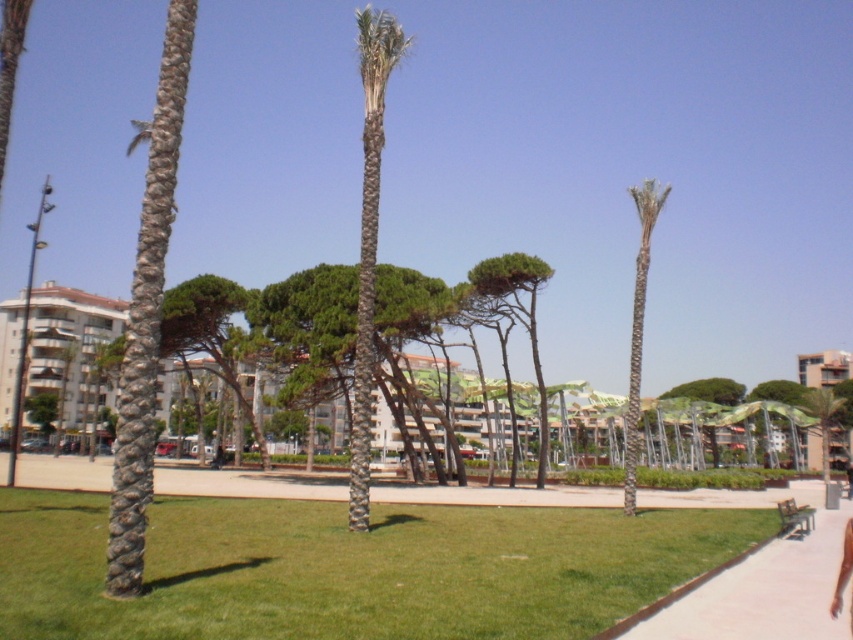
Who is shorter, gray textured palm tree at left or green textured palm tree at right?

gray textured palm tree at left is shorter.

The height and width of the screenshot is (640, 853). I want to click on gray textured palm tree at left, so click(148, 314).

Who is positioned more to the right, gray textured palm tree at left or green leafy palm tree at center?

green leafy palm tree at center is more to the right.

Does gray textured palm tree at left have a greater width compared to green leafy palm tree at center?

Correct, the width of gray textured palm tree at left exceeds that of green leafy palm tree at center.

What are the coordinates of `gray textured palm tree at left` in the screenshot? It's located at (148, 314).

This screenshot has height=640, width=853. In order to click on gray textured palm tree at left in this screenshot , I will do `click(148, 314)`.

Is green textured palm tree at right thinner than skinny tan skin at lower right?

No.

Between point (637, 266) and point (840, 600), which one is positioned behind?

The point (637, 266) is behind.

Image resolution: width=853 pixels, height=640 pixels. What are the coordinates of `green textured palm tree at right` in the screenshot? It's located at (637, 324).